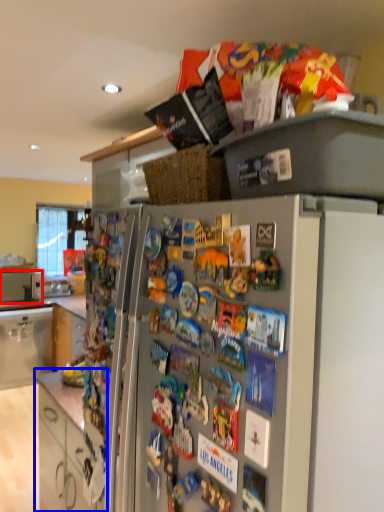
Question: Which of the following is the closest to the observer, appliance (highlighted by a red box) or cabinetry (highlighted by a blue box)?

Choices:
 (A) appliance
 (B) cabinetry

Answer: (B)